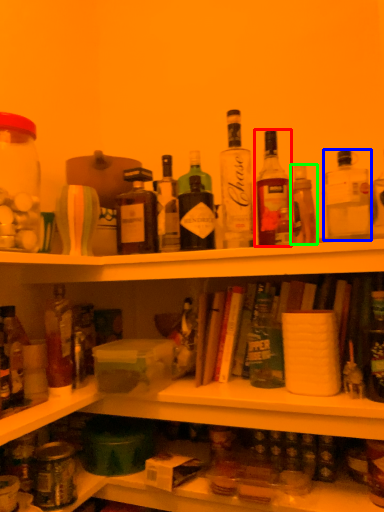
Question: Estimate the real-world distances between objects in this image. Which object is closer to bottle (highlighted by a red box), bottle (highlighted by a blue box) or bottle (highlighted by a green box)?

Choices:
 (A) bottle
 (B) bottle

Answer: (B)